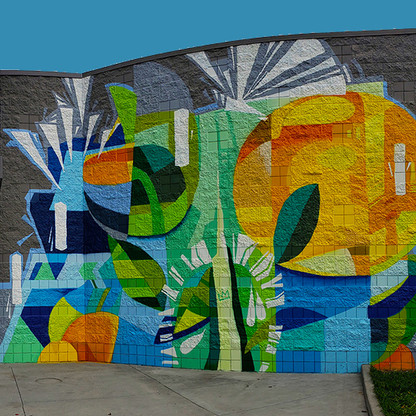
In order to click on wall in this screenshot , I will do pyautogui.click(x=19, y=235), pyautogui.click(x=174, y=223).